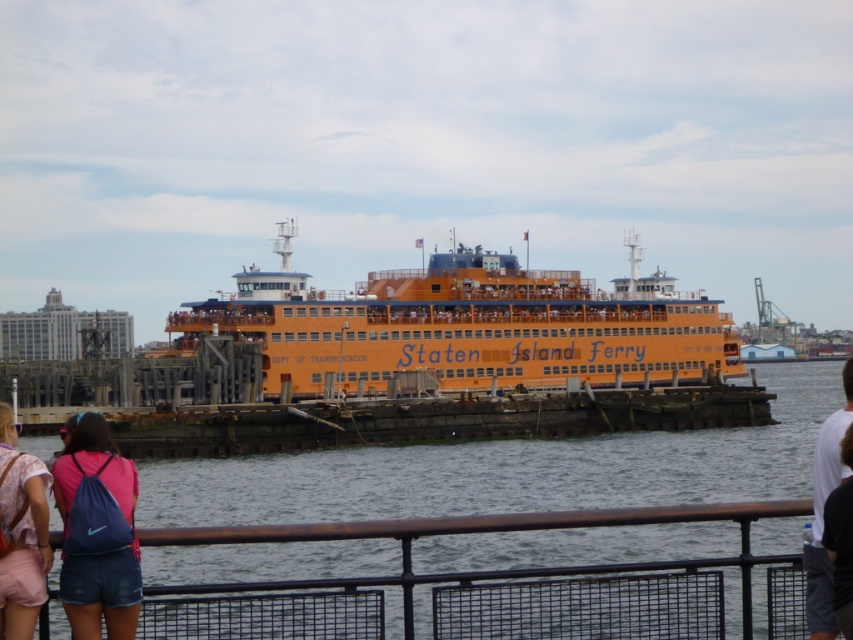
Question: Which object appears farthest from the camera in this image?

Choices:
 (A) white cotton shirt at lower right
 (B) denim shorts at lower left

Answer: (B)

Question: Estimate the real-world distances between objects in this image. Which object is farther from the orange matte staten island ferry at center?

Choices:
 (A) white cotton shirt at lower right
 (B) denim shorts at lower left
 (C) pink fabric backpack at lower left

Answer: (A)

Question: Which point is farther to the camera?

Choices:
 (A) clear water at center
 (B) orange matte staten island ferry at center
 (C) white cotton shirt at lower right
 (D) pink fabric backpack at lower left

Answer: (B)

Question: Considering the relative positions of pink fabric backpack at lower left and white cotton shirt at lower right in the image provided, where is pink fabric backpack at lower left located with respect to white cotton shirt at lower right?

Choices:
 (A) left
 (B) right

Answer: (A)

Question: Does orange matte staten island ferry at center lie in front of denim shorts at lower left?

Choices:
 (A) yes
 (B) no

Answer: (B)

Question: Considering the relative positions of orange matte staten island ferry at center and denim shorts at lower left in the image provided, where is orange matte staten island ferry at center located with respect to denim shorts at lower left?

Choices:
 (A) below
 (B) above

Answer: (B)